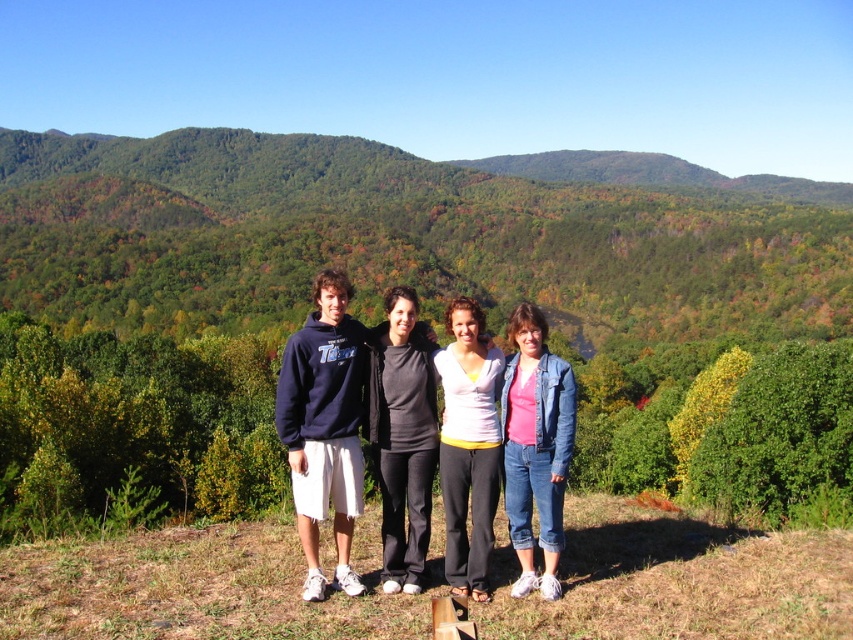
You are taking a photo of the group and want to focus on two specific points in the image, point 1 at coordinates point (338,198) and point 2 at coordinates point (384,458). Which point is closer to the camera?

Point (338,198) is further to the camera than point (384,458), so point (338,198) is closer to the camera.

You are standing on the grassy hillside and want to place a small flag at a point closer to you between the two points, point (366, 429) and point (350, 368). Which point should you choose?

Point (366, 429) is further to the viewer than point (350, 368), so you should choose point (366, 429) to place the flag closer to you.